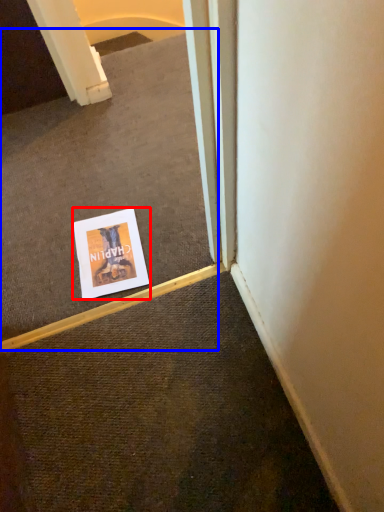
Question: Which of the following is the closest to the observer, poster (highlighted by a red box) or escalator (highlighted by a blue box)?

Choices:
 (A) poster
 (B) escalator

Answer: (B)